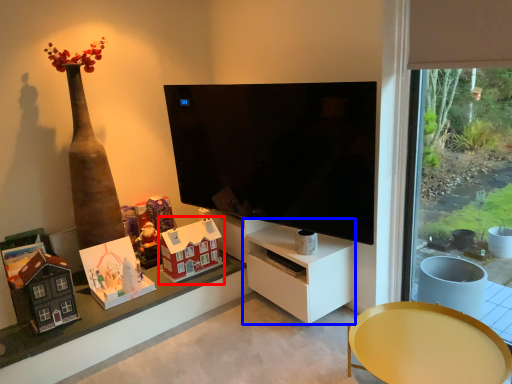
Question: Which object is closer to the camera taking this photo, toy (highlighted by a red box) or tv cabinet (highlighted by a blue box)?

Choices:
 (A) toy
 (B) tv cabinet

Answer: (B)